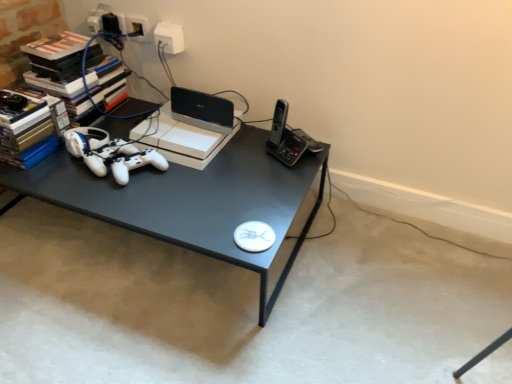
The width and height of the screenshot is (512, 384). Find the location of `vacant area in front of black plastic router at upper center`. vacant area in front of black plastic router at upper center is located at coordinates (195, 135).